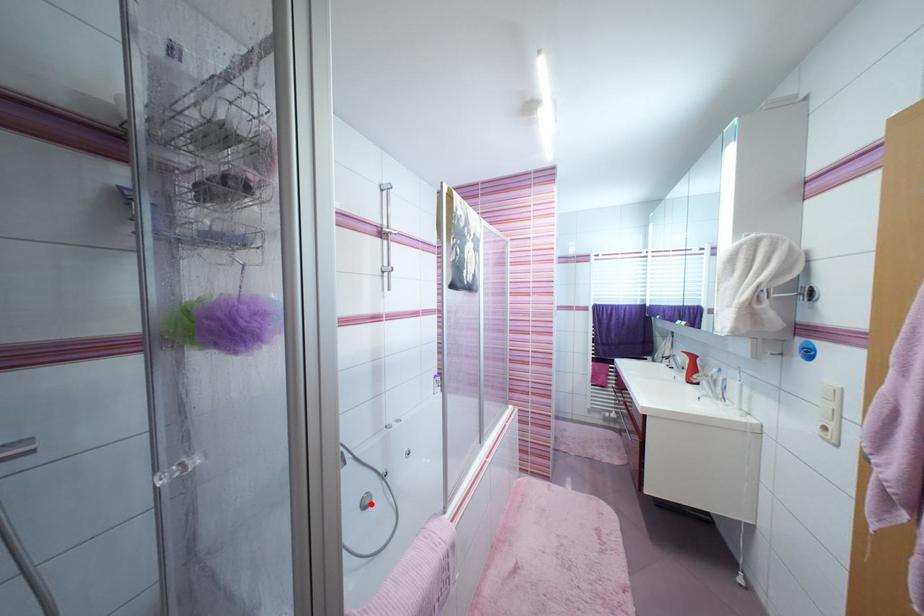
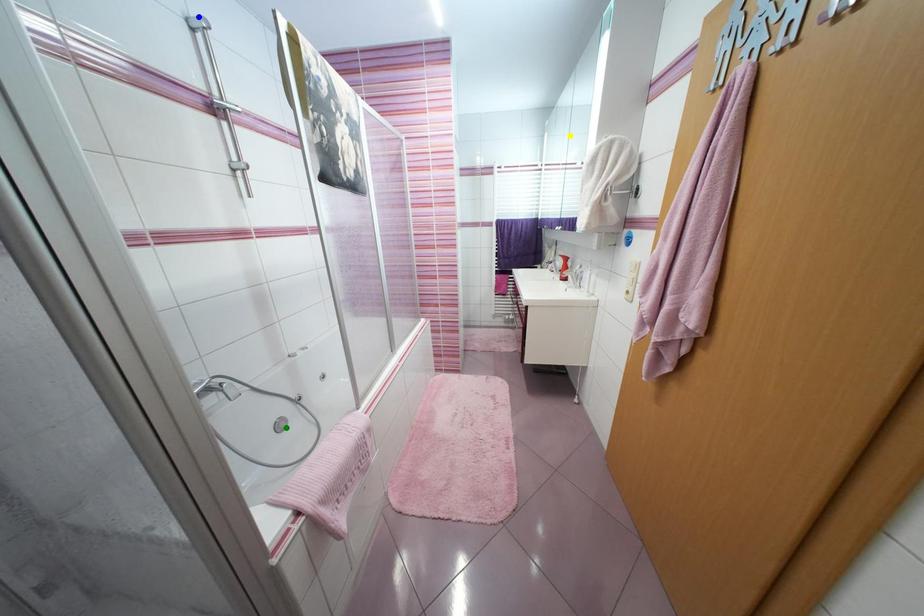
Question: I am providing you with two images of the same scene from different viewpoints. A red point is marked on the first image. You are given multiple points on the second image. Which spot in image 2 lines up with the point in image 1?

Choices:
 (A) blue point
 (B) yellow point
 (C) green point

Answer: (C)